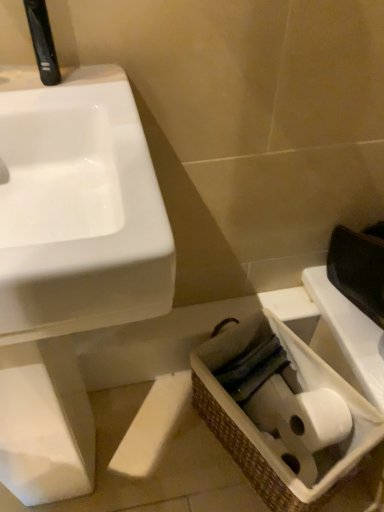
Question: Can you confirm if black plastic faucet at upper left is bigger than woven brown basket at lower right?

Choices:
 (A) no
 (B) yes

Answer: (A)

Question: Does black plastic faucet at upper left turn towards woven brown basket at lower right?

Choices:
 (A) no
 (B) yes

Answer: (A)

Question: From the image's perspective, is black plastic faucet at upper left located beneath woven brown basket at lower right?

Choices:
 (A) yes
 (B) no

Answer: (B)

Question: Is black plastic faucet at upper left turned away from woven brown basket at lower right?

Choices:
 (A) yes
 (B) no

Answer: (B)

Question: Is black plastic faucet at upper left to the right of woven brown basket at lower right from the viewer's perspective?

Choices:
 (A) yes
 (B) no

Answer: (B)

Question: Is black plastic faucet at upper left shorter than woven brown basket at lower right?

Choices:
 (A) yes
 (B) no

Answer: (A)

Question: Can you confirm if woven brown basket at lower right is smaller than white glossy sink at left?

Choices:
 (A) yes
 (B) no

Answer: (A)

Question: Can you confirm if woven brown basket at lower right is thinner than white glossy sink at left?

Choices:
 (A) no
 (B) yes

Answer: (B)

Question: Does woven brown basket at lower right have a greater height compared to white glossy sink at left?

Choices:
 (A) yes
 (B) no

Answer: (B)

Question: Can we say woven brown basket at lower right lies outside white glossy sink at left?

Choices:
 (A) no
 (B) yes

Answer: (B)

Question: Is woven brown basket at lower right oriented away from white glossy sink at left?

Choices:
 (A) yes
 (B) no

Answer: (B)

Question: Can you confirm if woven brown basket at lower right is positioned to the left of white glossy sink at left?

Choices:
 (A) yes
 (B) no

Answer: (B)

Question: Can you confirm if black plastic faucet at upper left is smaller than white glossy sink at left?

Choices:
 (A) yes
 (B) no

Answer: (A)